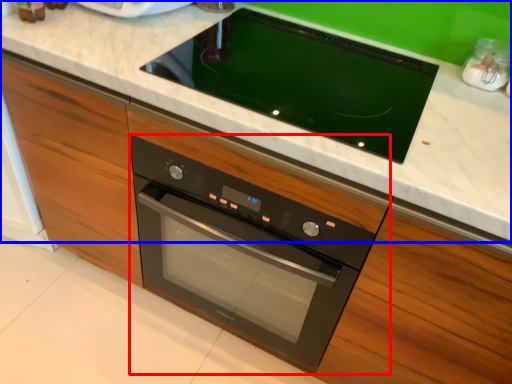
Question: Among these objects, which one is nearest to the camera, oven (highlighted by a red box) or countertop (highlighted by a blue box)?

Choices:
 (A) oven
 (B) countertop

Answer: (B)